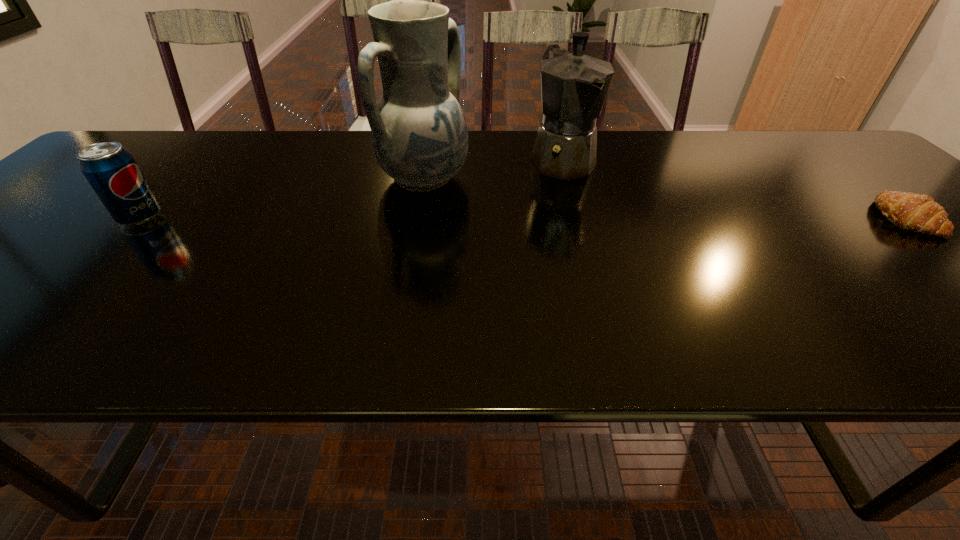
You are a GUI agent. You are given a task and a screenshot of the screen. Output one action in this format:
    pyautogui.click(x=<x>, y=<y>)
    Task: Click on the free space at the near edge
    The image size is (960, 540).
    Given the screenshot: What is the action you would take?
    pyautogui.click(x=18, y=303)

This screenshot has width=960, height=540. In order to click on free space at the right edge of the desktop in this screenshot , I will do `click(952, 269)`.

Image resolution: width=960 pixels, height=540 pixels. Find the location of `vacant space at the far right corner`. vacant space at the far right corner is located at coordinates (783, 135).

Image resolution: width=960 pixels, height=540 pixels. Find the location of `vacant space that is in between the coffeepot and the shortest object`. vacant space that is in between the coffeepot and the shortest object is located at coordinates (732, 188).

What are the coordinates of `free area in between the tallest object and the soda can` in the screenshot? It's located at (282, 199).

Find the location of a particular element. The height and width of the screenshot is (540, 960). free point between the coffeepot and the soda can is located at coordinates (351, 188).

The height and width of the screenshot is (540, 960). I want to click on free spot between the second object from left to right and the shortest object, so click(663, 199).

The image size is (960, 540). Find the location of `free space between the shortest object and the second shortest object`. free space between the shortest object and the second shortest object is located at coordinates (522, 218).

This screenshot has height=540, width=960. In order to click on vacant region between the shortest object and the tallest object in this screenshot , I will do `click(663, 199)`.

Image resolution: width=960 pixels, height=540 pixels. Find the location of `free space between the second object from right to left and the tallest object`. free space between the second object from right to left and the tallest object is located at coordinates (493, 170).